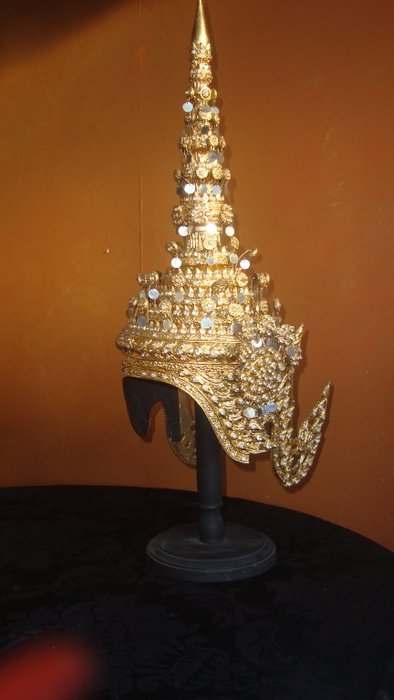
Identify the location of surface. (156, 661).